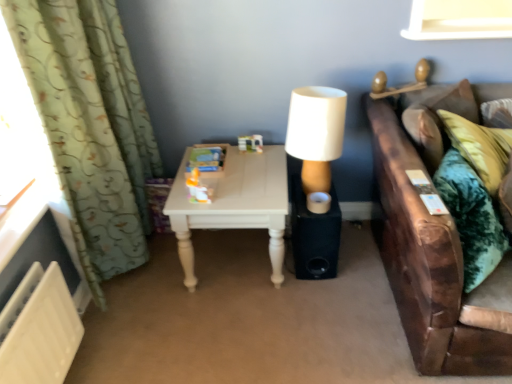
At what (x,y) coordinates should I click in order to perform the action: click on free point to the right of white painted wood table at center. Please return your answer as a coordinate pair (x, y). The width and height of the screenshot is (512, 384). Looking at the image, I should click on (346, 282).